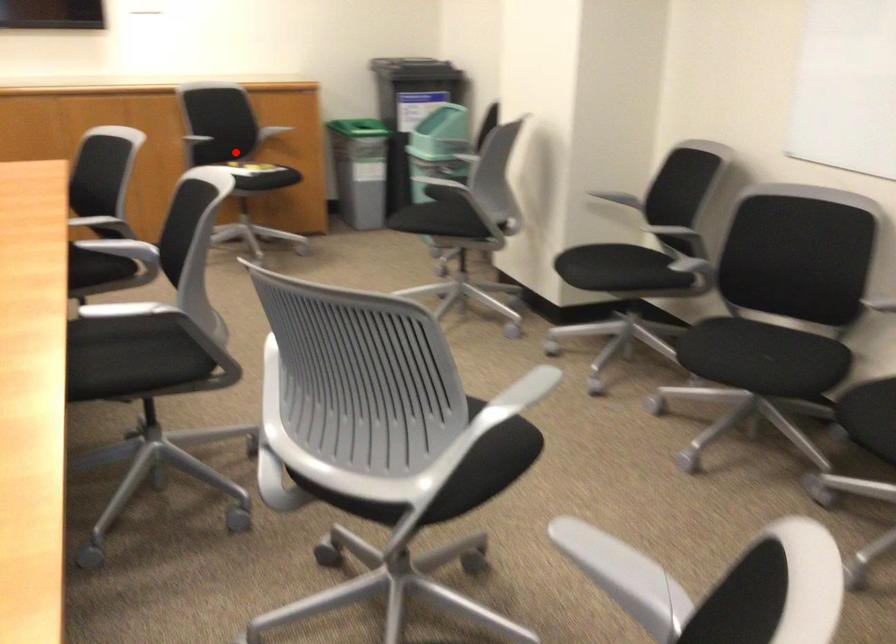
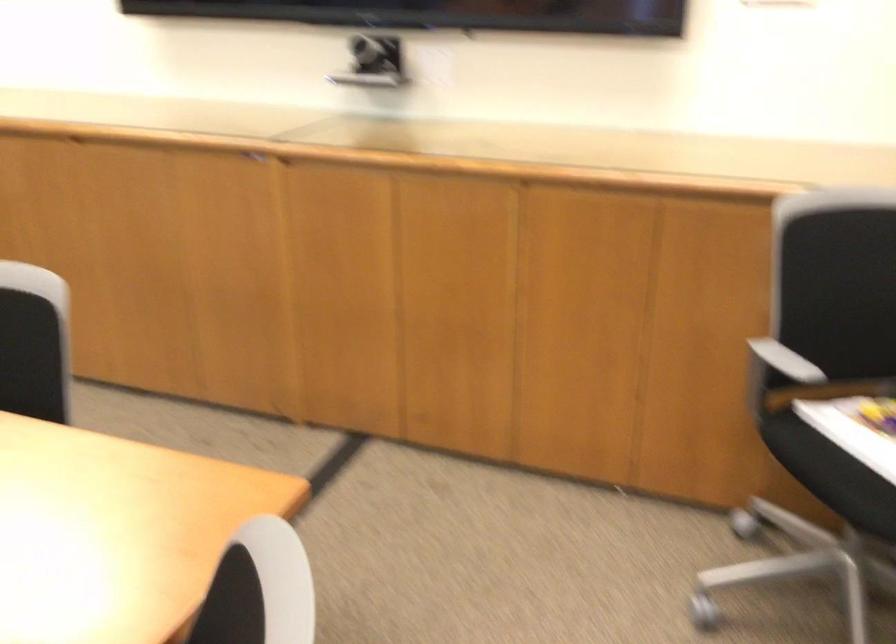
Find the pixel in the second image that matches the highlighted location in the first image.

(857, 442)